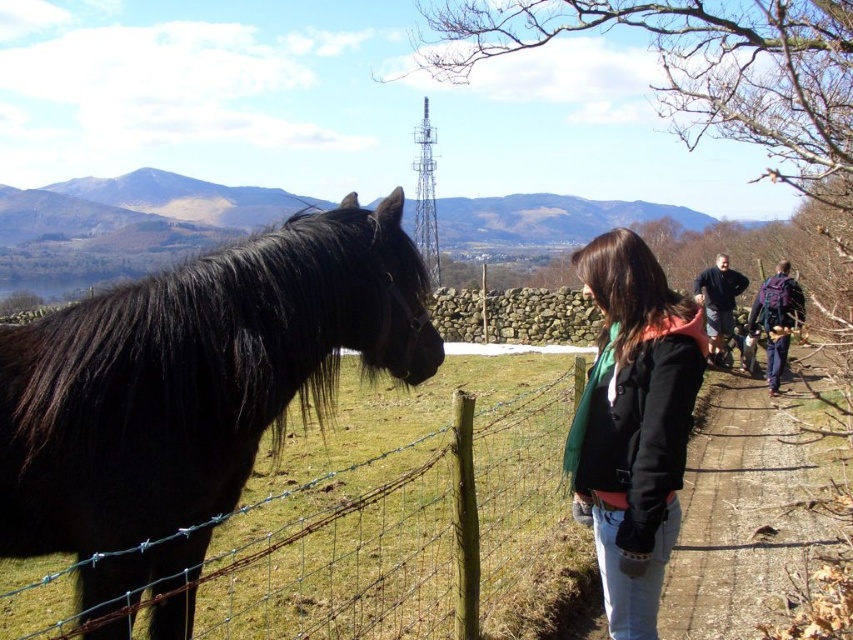
Between point (579, 253) and point (782, 273), which one is positioned behind?

The point (782, 273) is behind.

Is point (647, 468) in front of point (785, 266)?

That is True.

You are a GUI agent. You are given a task and a screenshot of the screen. Output one action in this format:
    pyautogui.click(x=<x>, y=<y>)
    Task: Click on the black fleece jacket at center
    
    Given the screenshot: What is the action you would take?
    pyautogui.click(x=634, y=422)

Is brown dirt path at lower right wider than dark blue fleece jacket at center?

In fact, brown dirt path at lower right might be narrower than dark blue fleece jacket at center.

This screenshot has height=640, width=853. What do you see at coordinates (747, 513) in the screenshot?
I see `brown dirt path at lower right` at bounding box center [747, 513].

In order to click on brown dirt path at lower right in this screenshot , I will do `click(747, 513)`.

Between dark blue backpack at right and dark blue fleece jacket at center, which one is positioned higher?

dark blue fleece jacket at center

Does dark blue backpack at right have a lesser width compared to dark blue fleece jacket at center?

Correct, dark blue backpack at right's width is less than dark blue fleece jacket at center's.

Who is more distant from viewer, (801, 300) or (728, 285)?

The point (728, 285) is behind.

Where is `dark blue backpack at right`? dark blue backpack at right is located at coordinates (776, 320).